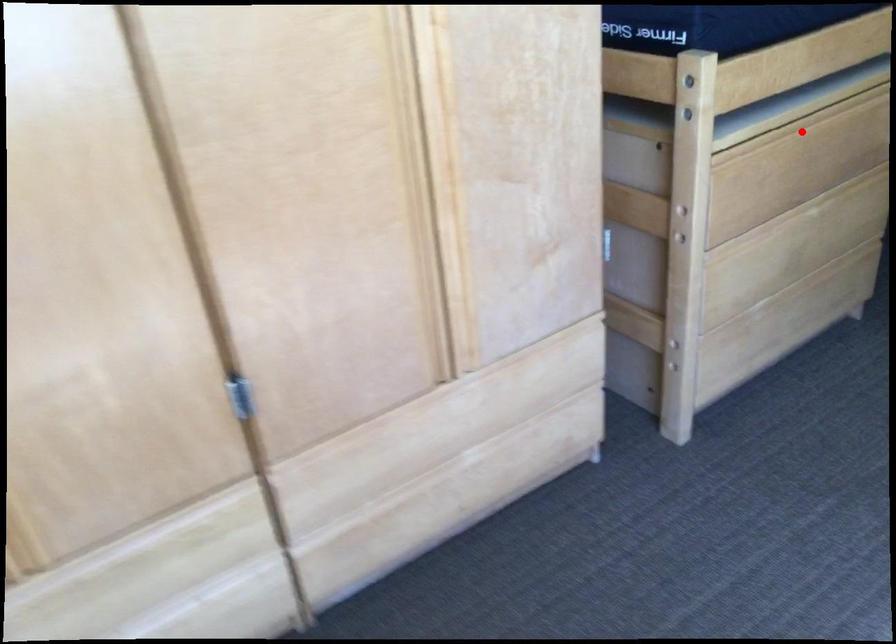
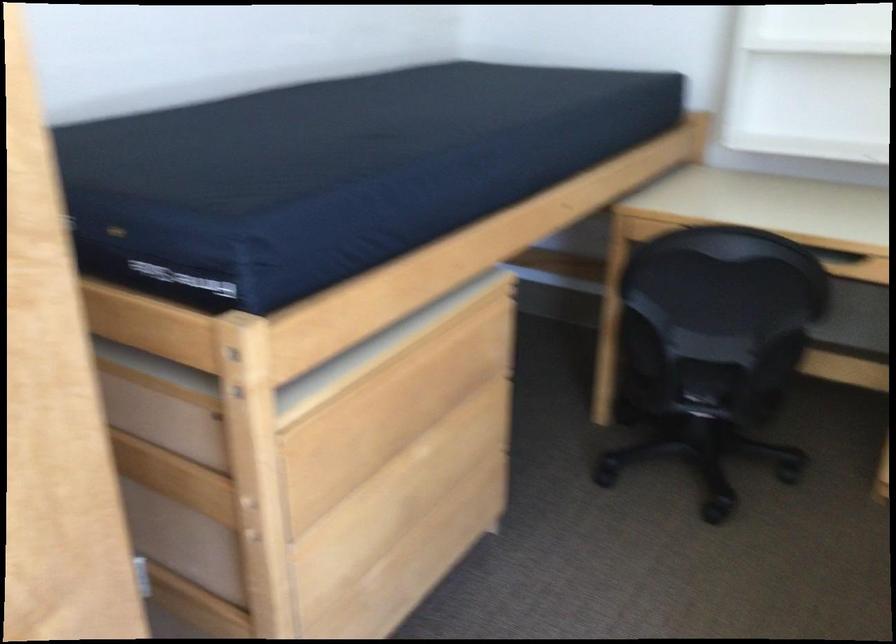
Question: I am providing you with two images of the same scene from different viewpoints. Given a red point in image1, look at the same physical point in image2. Is it:

Choices:
 (A) Closer to the viewpoint
 (B) Farther from the viewpoint

Answer: (A)